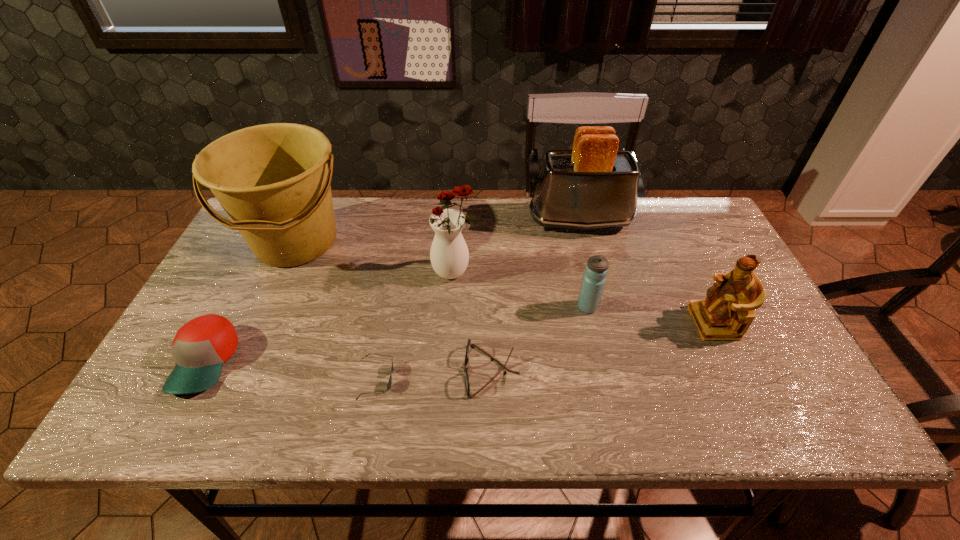
Image resolution: width=960 pixels, height=540 pixels. Find the location of `vacant area that satisfies the following two spatial constraints: 1. on the side of the bucket with the handle; 2. on the right side of the vase`. vacant area that satisfies the following two spatial constraints: 1. on the side of the bucket with the handle; 2. on the right side of the vase is located at coordinates (284, 271).